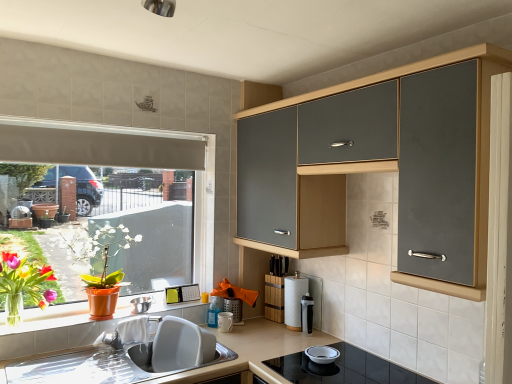
Locate an element on the screen. The height and width of the screenshot is (384, 512). vacant area that lies in front of metallic mesh container at center, which is the 4th appliance from left to right is located at coordinates (244, 338).